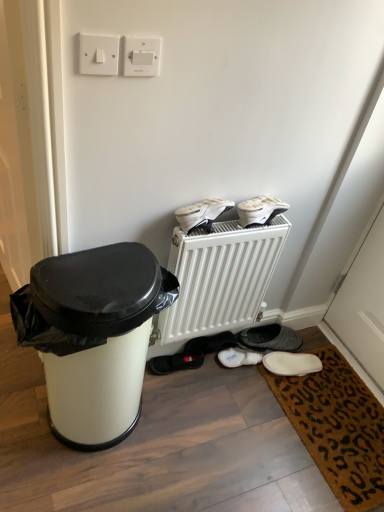
Locate an element on the screen. free space in front of white suede slippers at lower center, acting as the third footwear starting from the front is located at coordinates (243, 393).